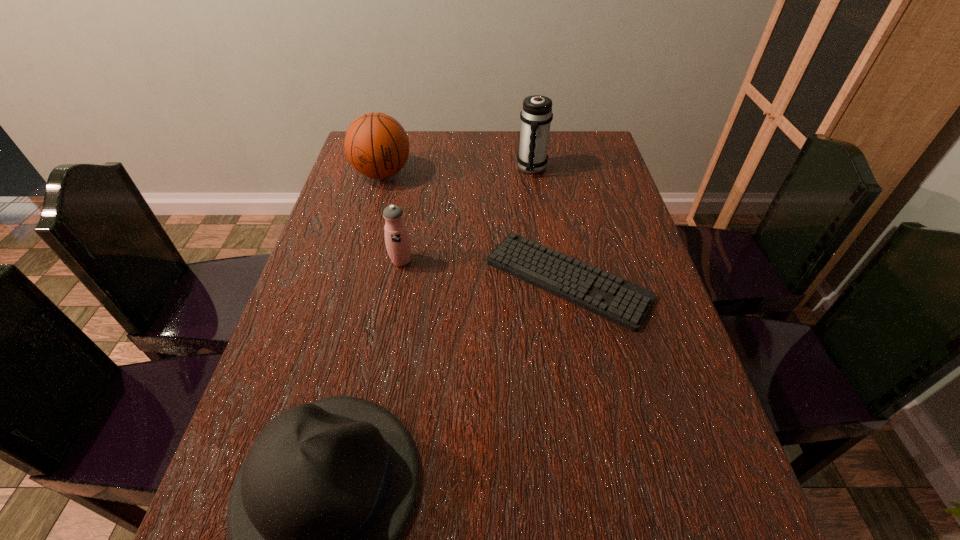
This screenshot has width=960, height=540. In order to click on free region that satisfies the following two spatial constraints: 1. on the side with the handle of the taller thermos bottle; 2. on the right side of the computer keyboard in this screenshot , I will do `click(548, 280)`.